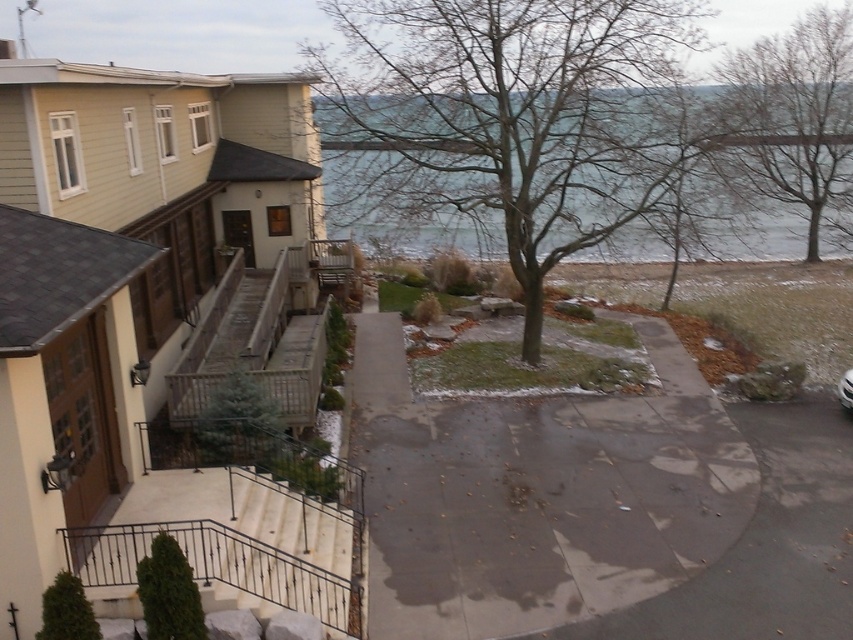
You are standing at the entrance of the driveway and want to park your car behind the house. The bare branches at center and the white glossy car at center are in your way. Which object should you move first to clear the path?

You should move the bare branches at center first because it is closer to you than the white glossy car at center, so you need to clear it before reaching the car.

In the scene shown: You are a delivery person trying to park your white glossy car at center in a residential area. There are bare branches at center in the way. Can you park your car without damaging the branches?

The bare branches at center might be wider than white glossy car at center, so there is a risk of damaging the branches if you try to park the car there. You should consider an alternative parking spot to avoid potential damage.